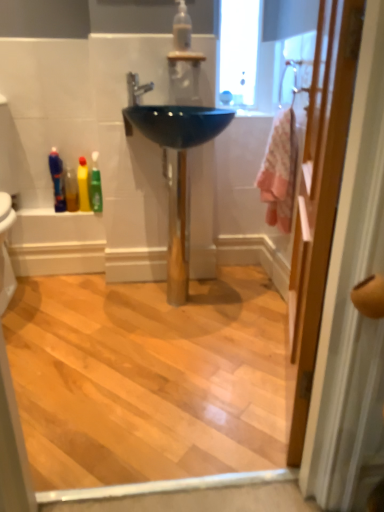
Question: Is point (281, 96) positioned closer to the camera than point (301, 220)?

Choices:
 (A) closer
 (B) farther

Answer: (B)

Question: Is matte white shower at upper right taller or shorter than pink fabric at right?

Choices:
 (A) tall
 (B) short

Answer: (B)

Question: Which object is the farthest from the glossy ceramic sink at center?

Choices:
 (A) translucent plastic mouthwash at left, acting as the second mouthwash starting from the front
 (B) yellow matte bottle at lower left, placed as the second toiletry when sorted from left to right
 (C) pink fabric at right
 (D) green plastic toothpaste tube at left, marked as the first toiletry in a right-to-left arrangement
 (E) pink fabric bath towel at right

Answer: (C)

Question: Estimate the real-world distances between objects in this image. Which object is closer to the matte white shower at upper right?

Choices:
 (A) translucent plastic bottles at lower left, which appears as the 1th toiletry when viewed from the left
 (B) glossy ceramic sink at center
 (C) translucent plastic mouthwash at left, which ranks as the first mouthwash in left-to-right order
 (D) green plastic toothpaste tube at left, marked as the first toiletry in a right-to-left arrangement
 (E) silver metallic faucet at center

Answer: (B)